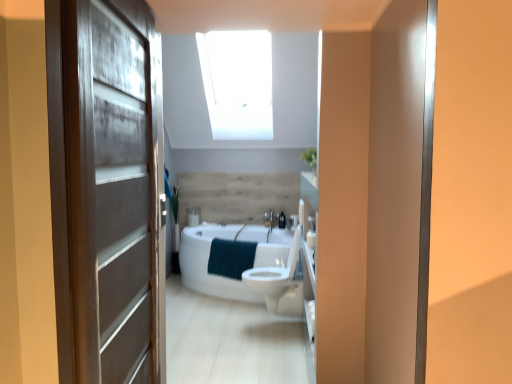
Question: Is matte brown door at left closer to the viewer compared to teal soft towel at center?

Choices:
 (A) yes
 (B) no

Answer: (A)

Question: Is teal soft towel at center a part of matte brown door at left?

Choices:
 (A) no
 (B) yes

Answer: (A)

Question: Considering the relative sizes of matte brown door at left and teal soft towel at center in the image provided, is matte brown door at left wider than teal soft towel at center?

Choices:
 (A) no
 (B) yes

Answer: (A)

Question: Considering the relative sizes of matte brown door at left and teal soft towel at center in the image provided, is matte brown door at left thinner than teal soft towel at center?

Choices:
 (A) yes
 (B) no

Answer: (A)

Question: Does matte brown door at left have a greater height compared to teal soft towel at center?

Choices:
 (A) yes
 (B) no

Answer: (A)

Question: In the image, is white matte toilet paper at right positioned in front of or behind white glossy bathtub at center?

Choices:
 (A) front
 (B) behind

Answer: (A)

Question: Is point (309, 238) positioned closer to the camera than point (185, 246)?

Choices:
 (A) farther
 (B) closer

Answer: (B)

Question: From their relative heights in the image, would you say white matte toilet paper at right is taller or shorter than white glossy bathtub at center?

Choices:
 (A) tall
 (B) short

Answer: (B)

Question: In terms of size, does white matte toilet paper at right appear bigger or smaller than white glossy bathtub at center?

Choices:
 (A) small
 (B) big

Answer: (A)

Question: Considering their positions, is white glossy bathtub at center located in front of or behind teal soft towel at center?

Choices:
 (A) behind
 (B) front

Answer: (B)

Question: Is white glossy bathtub at center spatially inside teal soft towel at center, or outside of it?

Choices:
 (A) inside
 (B) outside

Answer: (B)

Question: From the image's perspective, is white glossy bathtub at center above or below teal soft towel at center?

Choices:
 (A) above
 (B) below

Answer: (B)

Question: Is point (230, 273) positioned closer to the camera than point (230, 241)?

Choices:
 (A) farther
 (B) closer

Answer: (A)

Question: In the image, is matte brown door at left positioned in front of or behind teal soft towel at center?

Choices:
 (A) behind
 (B) front

Answer: (B)

Question: Considering the positions of matte brown door at left and teal soft towel at center in the image, is matte brown door at left wider or thinner than teal soft towel at center?

Choices:
 (A) wide
 (B) thin

Answer: (B)